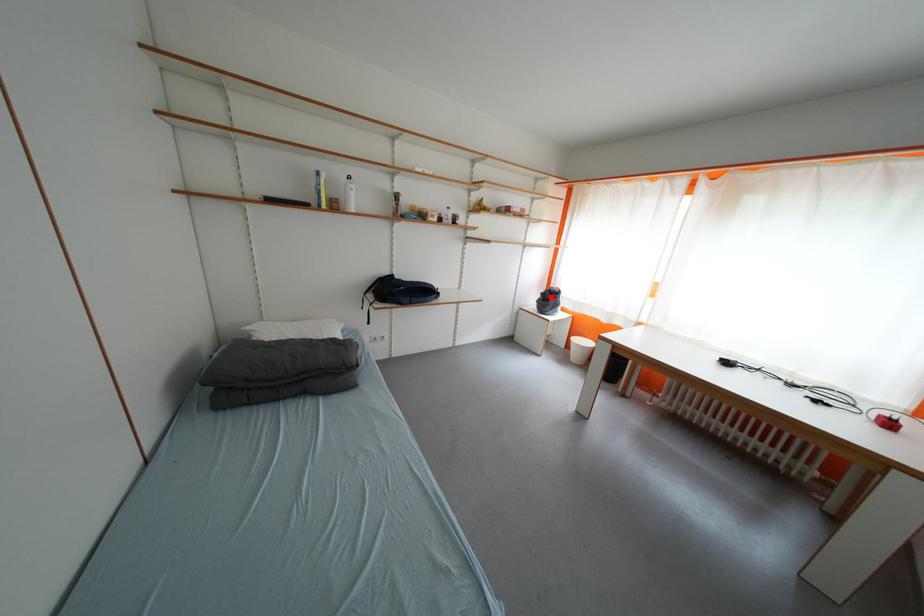
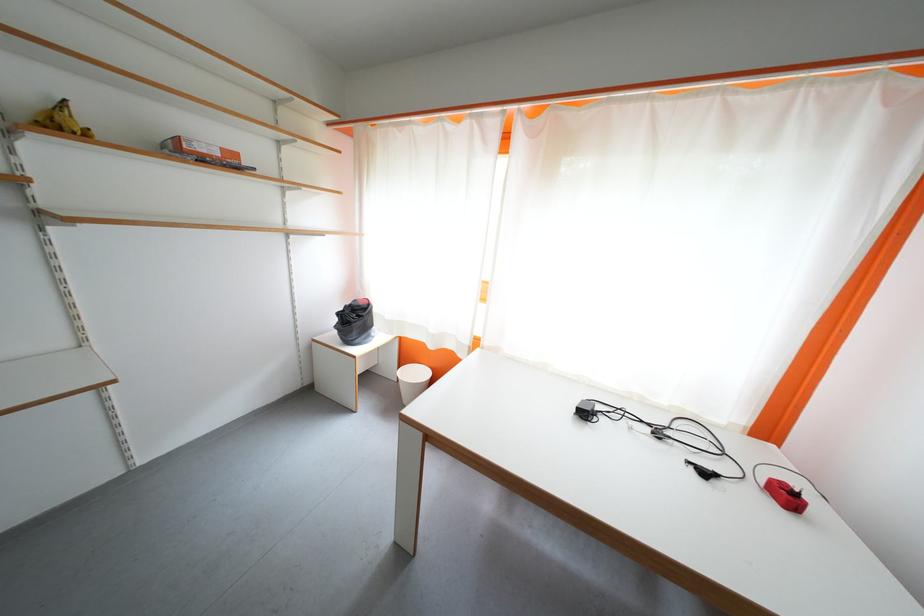
The point at the highlighted location is marked in the first image. Where is the corresponding point in the second image?

(347, 317)